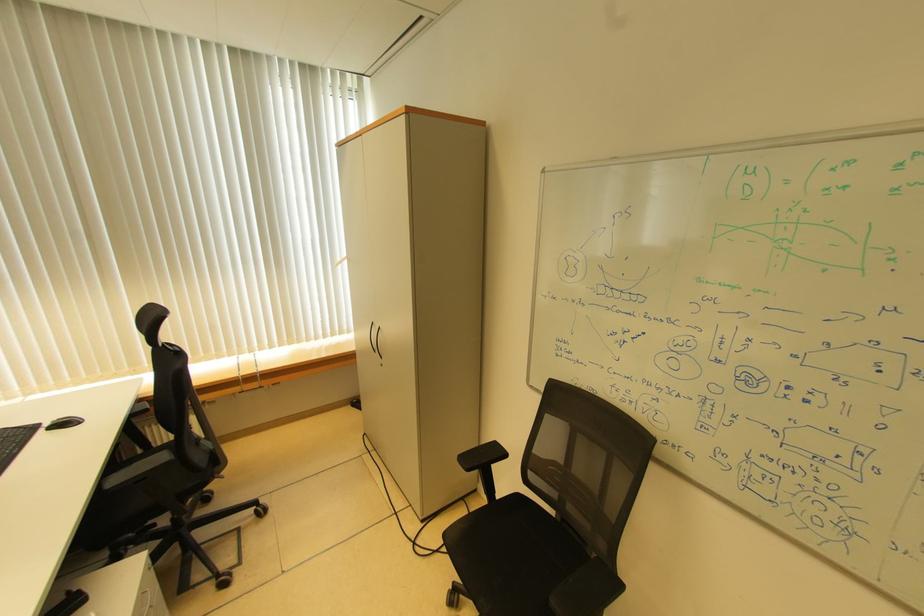
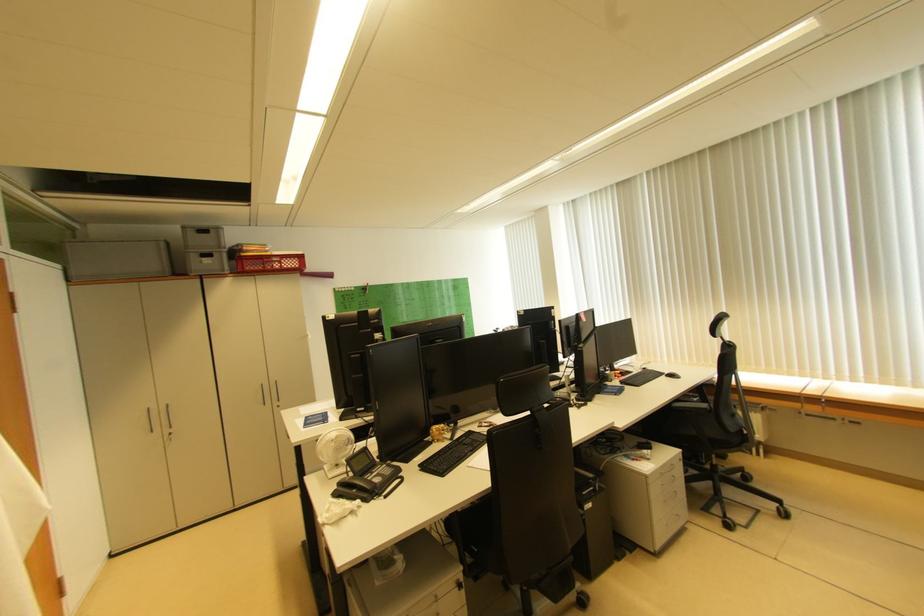
Question: The images are taken continuously from a first-person perspective. In which direction is your viewpoint rotating?

Choices:
 (A) Left
 (B) Right
 (C) Up
 (D) Down

Answer: (A)